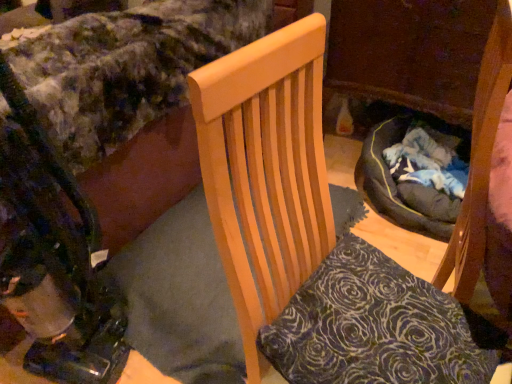
Question: Is velvety dark blue pillow at center taller or shorter than metallic black baby carriage at lower left?

Choices:
 (A) tall
 (B) short

Answer: (B)

Question: Is velvety dark blue pillow at center to the left or to the right of metallic black baby carriage at lower left in the image?

Choices:
 (A) right
 (B) left

Answer: (A)

Question: Considering the real-world distances, which object is closest to the metallic black baby carriage at lower left?

Choices:
 (A) wooden chair at center
 (B) velvety floral bedspread at upper left
 (C) velvety dark blue pillow at center

Answer: (B)

Question: Which object is the farthest from the metallic black baby carriage at lower left?

Choices:
 (A) wooden chair at center
 (B) velvety dark blue pillow at center
 (C) velvety floral bedspread at upper left

Answer: (B)